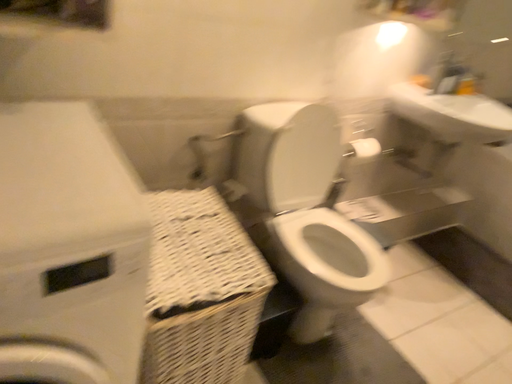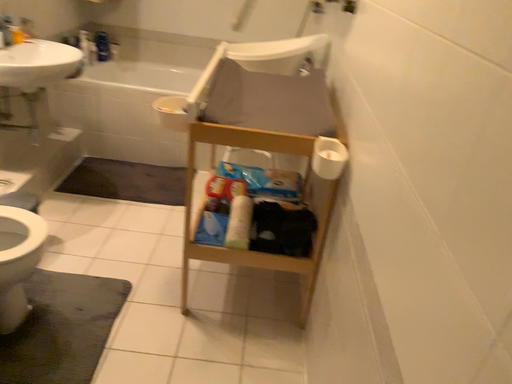
Question: Which way did the camera rotate in the video?

Choices:
 (A) rotated left
 (B) rotated right

Answer: (B)